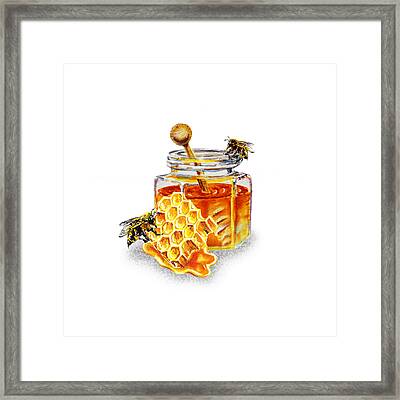
This screenshot has width=400, height=400. Find the location of `picture frame`. picture frame is located at coordinates (324, 261).